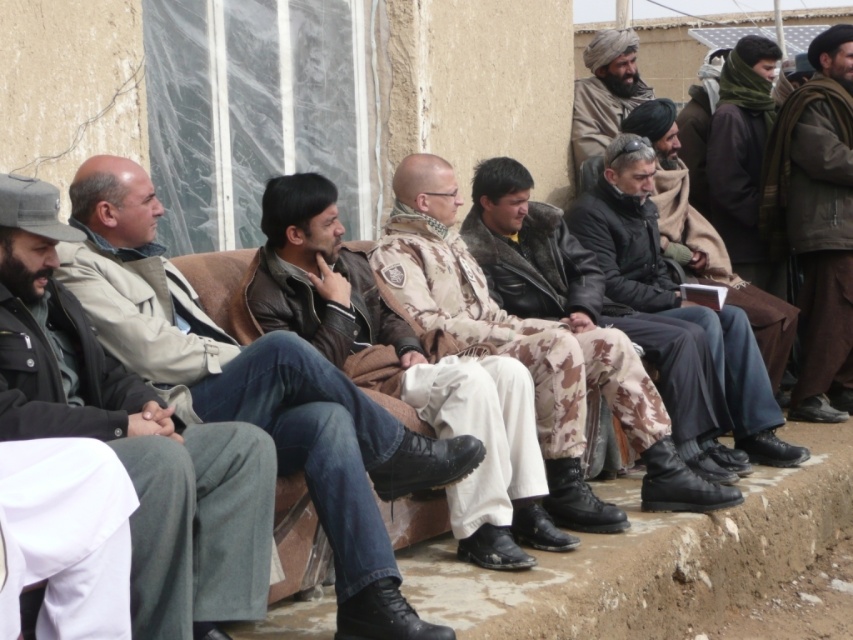
Based on the photo, does camouflage jacket at center have a lesser width compared to brown woolen scarf at upper right?

In fact, camouflage jacket at center might be wider than brown woolen scarf at upper right.

Locate an element on the screen. The image size is (853, 640). camouflage jacket at center is located at coordinates (257, 392).

This screenshot has width=853, height=640. I want to click on camouflage jacket at center, so click(257, 392).

Between camouflage jacket at center and camouflage pants at center, which one appears on the left side from the viewer's perspective?

Positioned to the left is camouflage jacket at center.

Which is in front, point (164, 376) or point (544, 243)?

Point (164, 376) is in front.

Which is behind, point (259, 348) or point (547, 284)?

The point (547, 284) is behind.

At what (x,y) coordinates should I click in order to perform the action: click on camouflage jacket at center. Please return your answer as a coordinate pair (x, y). Image resolution: width=853 pixels, height=640 pixels. Looking at the image, I should click on (257, 392).

Is camouflage jacket at center taller than brown leather jacket at center?

Indeed, camouflage jacket at center has a greater height compared to brown leather jacket at center.

Identify the location of camouflage jacket at center. (257, 392).